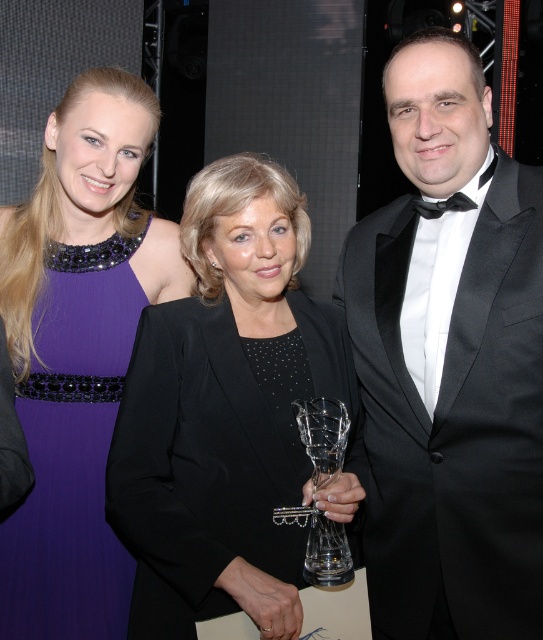
You are a photographer adjusting the lighting for the photo shoot. You need to position a spotlight exactly at the coordinates point (228, 413) to highlight the main subject. Which object in the scene is located at this point?

The black satin blazer at center is located at point (228, 413).

You are a photographer at the event. You want to adjust the lighting so that the clear glass trophy at center is more visible. What should you do about the black satin blazer at center?

The black satin blazer at center is in front of the clear glass trophy at center, so moving it aside or adjusting the angle would allow the trophy to be more visible.